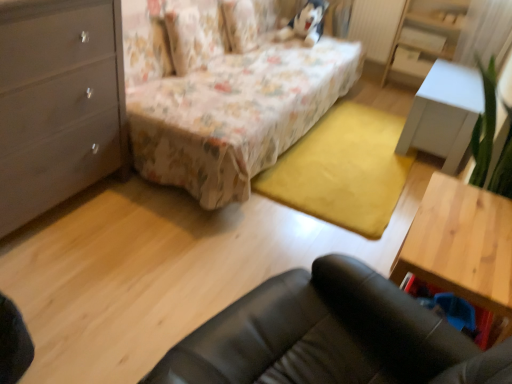
The height and width of the screenshot is (384, 512). In order to click on free space between white glossy dresser at upper right and floral fabric bed at center in this screenshot , I will do tap(358, 131).